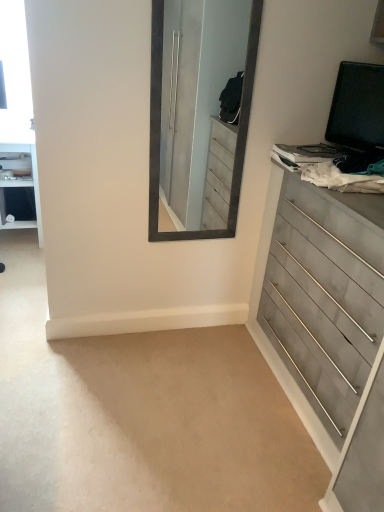
Question: Would you say gray wood dresser at right is part of white glossy vanity at left's contents?

Choices:
 (A) no
 (B) yes

Answer: (A)

Question: Is white glossy vanity at left not close to gray wood dresser at right?

Choices:
 (A) no
 (B) yes

Answer: (B)

Question: Is white glossy vanity at left not inside gray wood dresser at right?

Choices:
 (A) yes
 (B) no

Answer: (A)

Question: Does white glossy vanity at left have a smaller size compared to gray wood dresser at right?

Choices:
 (A) yes
 (B) no

Answer: (A)

Question: Does white glossy vanity at left lie in front of gray wood dresser at right?

Choices:
 (A) yes
 (B) no

Answer: (B)

Question: Considering the relative sizes of white glossy vanity at left and gray wood dresser at right in the image provided, is white glossy vanity at left taller than gray wood dresser at right?

Choices:
 (A) no
 (B) yes

Answer: (A)

Question: Is there a large distance between gray wood dresser at right and white glossy vanity at left?

Choices:
 (A) no
 (B) yes

Answer: (B)

Question: Is gray wood dresser at right to the left of white glossy vanity at left from the viewer's perspective?

Choices:
 (A) yes
 (B) no

Answer: (B)

Question: Considering the relative sizes of gray wood dresser at right and white glossy vanity at left in the image provided, is gray wood dresser at right shorter than white glossy vanity at left?

Choices:
 (A) yes
 (B) no

Answer: (B)

Question: Is gray wood dresser at right beside white glossy vanity at left?

Choices:
 (A) yes
 (B) no

Answer: (B)

Question: Can you confirm if gray wood dresser at right is taller than white glossy vanity at left?

Choices:
 (A) yes
 (B) no

Answer: (A)

Question: Is the position of gray wood dresser at right more distant than that of white glossy vanity at left?

Choices:
 (A) yes
 (B) no

Answer: (B)

Question: Looking at their shapes, would you say white glossy vanity at left is wider or thinner than gray wood dresser at right?

Choices:
 (A) wide
 (B) thin

Answer: (A)